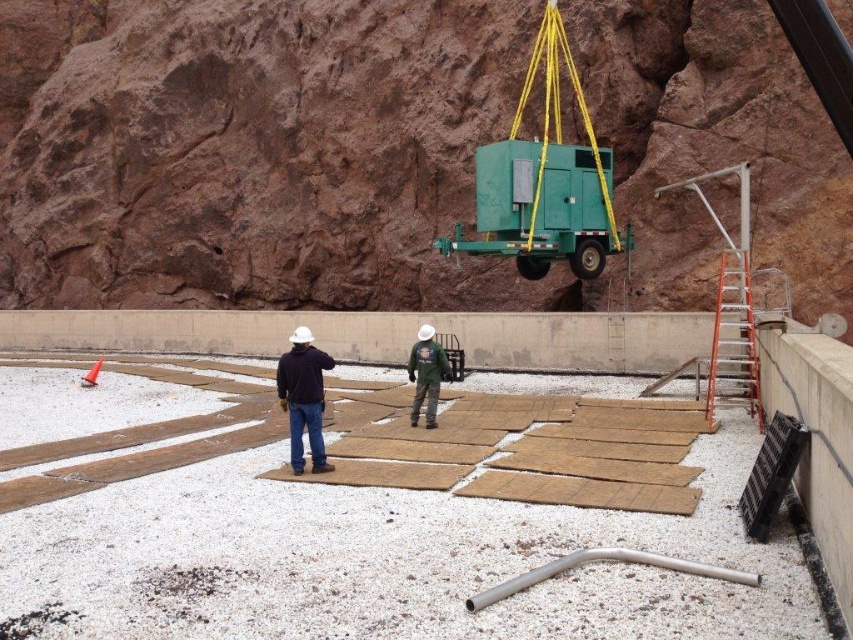
Question: Is brown wood planks at center in front of matte black jacket at center?

Choices:
 (A) yes
 (B) no

Answer: (A)

Question: Estimate the real-world distances between objects in this image. Which object is closer to the green matte trailer at upper center?

Choices:
 (A) brown wood planks at center
 (B) matte black jacket at center

Answer: (A)

Question: Among these points, which one is farthest from the camera?

Choices:
 (A) (408, 524)
 (B) (283, 380)

Answer: (B)

Question: Can you confirm if brown wood planks at center is positioned above green matte trailer at upper center?

Choices:
 (A) yes
 (B) no

Answer: (B)

Question: Does brown wood planks at center appear over green matte trailer at upper center?

Choices:
 (A) no
 (B) yes

Answer: (A)

Question: Which point appears farthest from the camera in this image?

Choices:
 (A) pyautogui.click(x=297, y=403)
 (B) pyautogui.click(x=59, y=612)

Answer: (A)